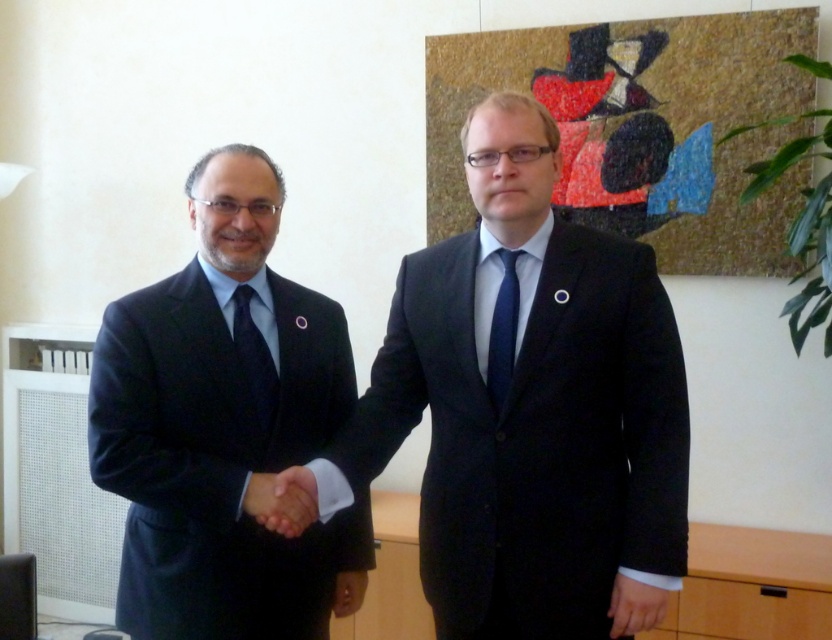
You are an artist analyzing the composition of the scene. The matte black hand at lower right is part of a handshake between two men. Based on its position at point coordinates, can you determine if the hand is closer to the edge of the frame or the center?

The matte black hand at lower right is located at point coordinates, so it is closer to the edge of the frame than the center.

You are a photographer adjusting the lighting in the scene. You need to ensure that both the black matte hand at center and the blue silk tie at center are well lit. Since one is shorter than the other, which object should you adjust the light to focus on first?

The black matte hand at center is shorter than the blue silk tie at center, so you should adjust the light to focus on the black matte hand at center first to ensure proper illumination.

You are a photographer adjusting the lighting for a portrait. You notice the black matte hand at center and the blue silk tie at center in the frame. Which object should you focus on first to ensure proper exposure, the one closer to the camera or the one further away?

The black matte hand at center is in front of the blue silk tie at center, so you should focus on the black matte hand at center first to ensure proper exposure since it is closer to the camera.